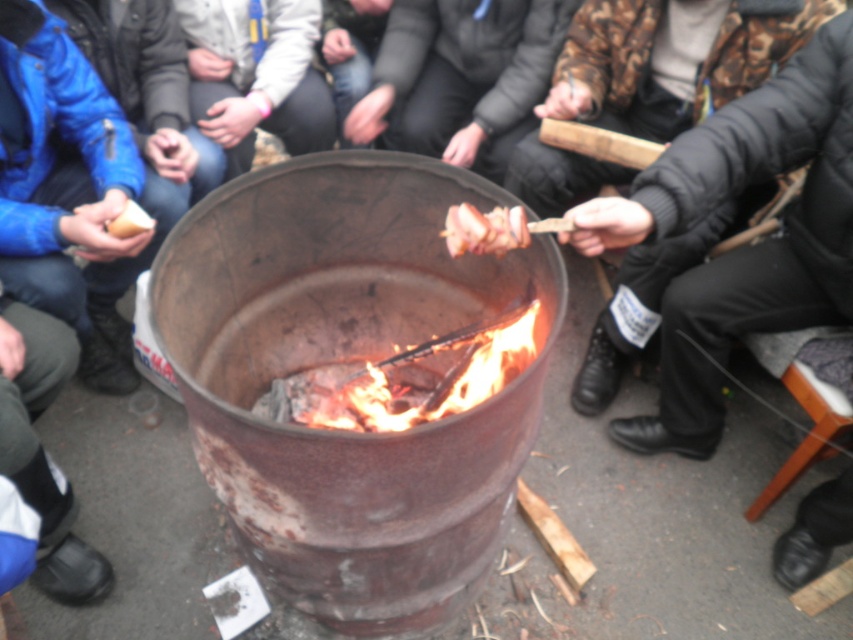
Question: Which object is farther from the camera taking this photo?

Choices:
 (A) matte brown bread at left
 (B) charcoal wood at center
 (C) black puffy jacket at upper right
 (D) brown wooden skewer at center

Answer: (A)

Question: Which point is farther to the camera?

Choices:
 (A) (795, 256)
 (B) (386, 365)
 (C) (461, 205)
 (D) (120, 225)

Answer: (D)

Question: Which of the following is the closest to the observer?

Choices:
 (A) black puffy jacket at upper right
 (B) brown wooden skewer at center
 (C) matte brown bread at left
 (D) charcoal wood at center

Answer: (A)

Question: Is black puffy jacket at upper right to the left of charcoal wood at center from the viewer's perspective?

Choices:
 (A) no
 (B) yes

Answer: (A)

Question: Is charcoal wood at center smaller than brown wooden skewer at center?

Choices:
 (A) no
 (B) yes

Answer: (A)

Question: Can you confirm if black puffy jacket at upper right is positioned above brown wooden skewer at center?

Choices:
 (A) yes
 (B) no

Answer: (B)